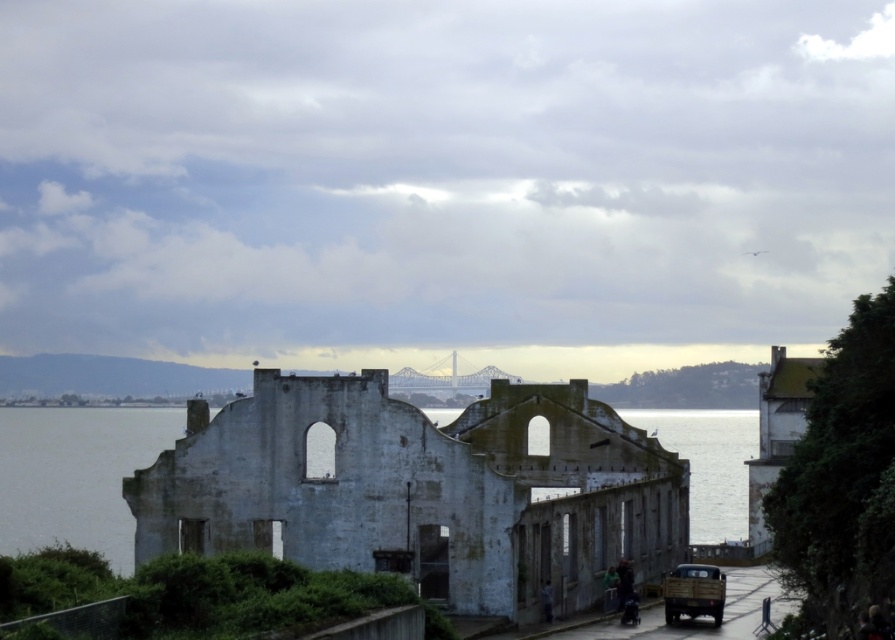
Consider the image. You are a photographer standing on the pathway near the dilapidated building. You want to capture a photo of the dark hair at lower center and the green fabric jacket at lower center. Which object will appear larger in your photo?

The dark hair at lower center will appear larger in the photo because it is closer to the viewer than the green fabric jacket at lower center.

You are a photographer standing at the edge of the paved pathway leading to the dilapidated building. You want to capture a photo that includes both the matte brown truck at lower right and the blue denim jeans at lower center. Which object should you focus on first to ensure both are in frame without moving the camera?

You should focus on the matte brown truck at lower right first because it is taller than the blue denim jeans at lower center, so adjusting the camera angle to include its height will naturally include the shorter jeans in the frame.

You are standing on the paved pathway near the dilapidated building and notice two items at lower center. Which item is higher up in the image, the green fabric jacket at lower center or the blue denim jeans at lower center?

The green fabric jacket at lower center is taller than the blue denim jeans at lower center, so the green fabric jacket at lower center is higher up in the image.